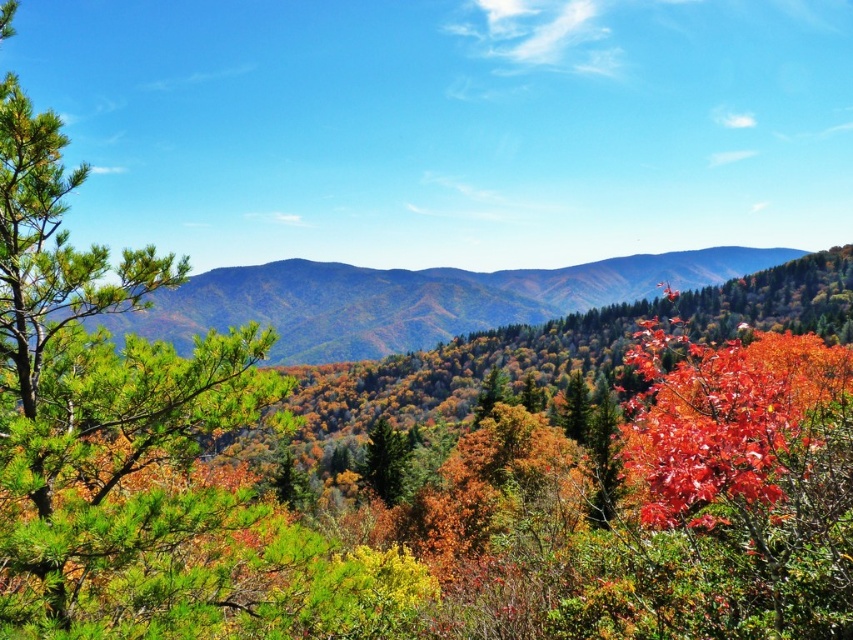
Which is behind, point (566, 282) or point (392, 445)?

The point (566, 282) is behind.

Is green matte forest at center below green matte tree at center?

Actually, green matte forest at center is above green matte tree at center.

This screenshot has width=853, height=640. Find the location of `green matte forest at center`. green matte forest at center is located at coordinates (412, 300).